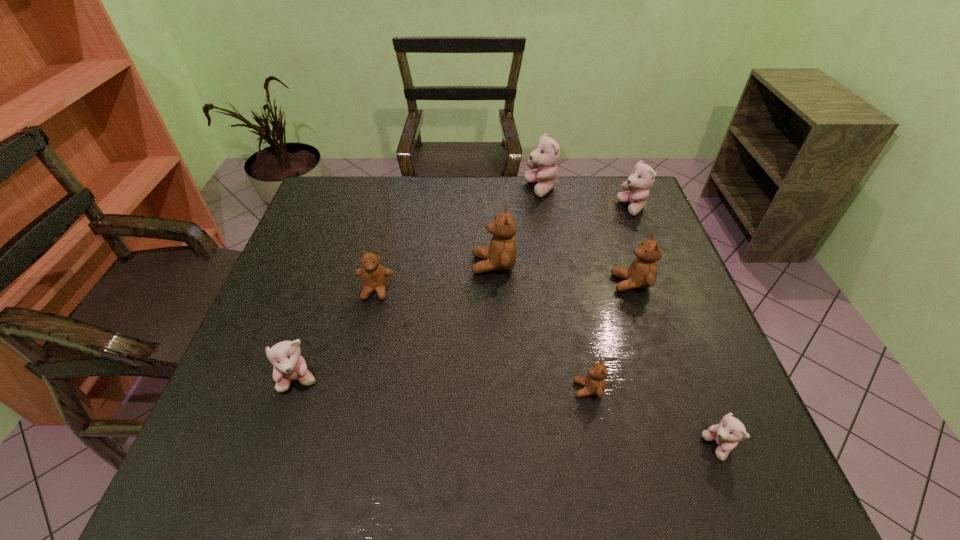
I want to click on free location that satisfies the following two spatial constraints: 1. at the face of the biggest pink teddy bear; 2. on the face of the second object from left to right, so click(559, 291).